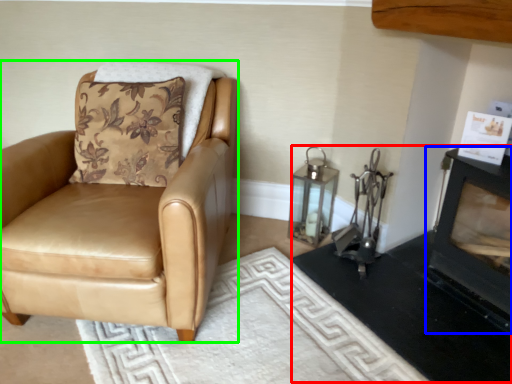
Question: Which is farther away from fireplace (highlighted by a red box)? fireplace (highlighted by a blue box) or chair (highlighted by a green box)?

Choices:
 (A) fireplace
 (B) chair

Answer: (B)